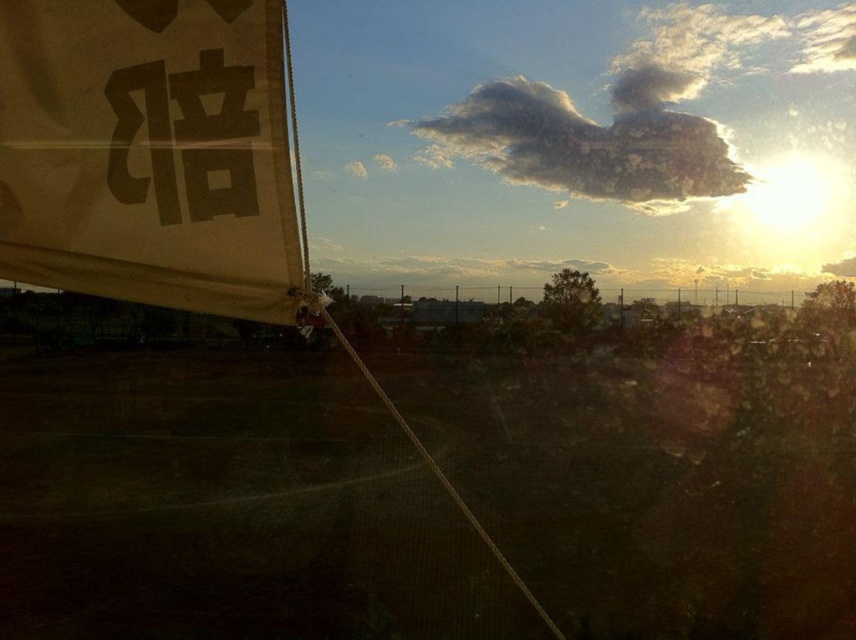
Where is `white fabric sign at upper left`? white fabric sign at upper left is located at coordinates (149, 154).

Does white fabric sign at upper left appear under white fluffy cloud at upper center?

Indeed, white fabric sign at upper left is positioned under white fluffy cloud at upper center.

Is point (250, 147) more distant than point (572, 186)?

No, (250, 147) is in front of (572, 186).

Identify the location of white fabric sign at upper left. 149,154.